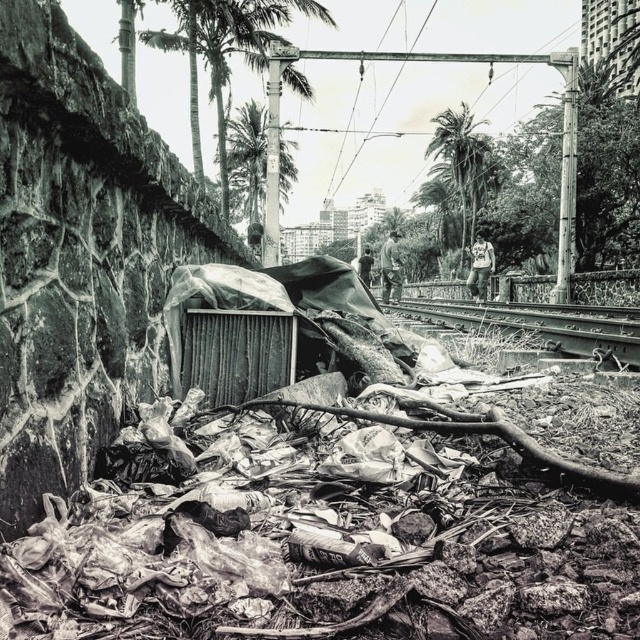
Question: Which object is farther from the camera taking this photo?

Choices:
 (A) smooth metal train track at center
 (B) thick textured palm tree at upper center
 (C) green leafy palm tree at upper right

Answer: (C)

Question: Observing the image, what is the correct spatial positioning of thick textured palm tree at upper center in reference to green leafy palm tree at upper right?

Choices:
 (A) below
 (B) above

Answer: (B)

Question: Can you confirm if thick textured palm tree at upper center is positioned to the left of green leafy palm tree at upper right?

Choices:
 (A) yes
 (B) no

Answer: (A)

Question: Based on their relative distances, which object is farther from the smooth metal train track at center?

Choices:
 (A) green leafy palm tree at upper right
 (B) thick textured palm tree at upper center

Answer: (A)

Question: Observing the image, what is the correct spatial positioning of smooth metal train track at center in reference to green leafy palm tree at upper right?

Choices:
 (A) above
 (B) below

Answer: (B)

Question: Estimate the real-world distances between objects in this image. Which object is farther from the green leafy palm tree at upper right?

Choices:
 (A) smooth metal train track at center
 (B) thick textured palm tree at upper center

Answer: (A)